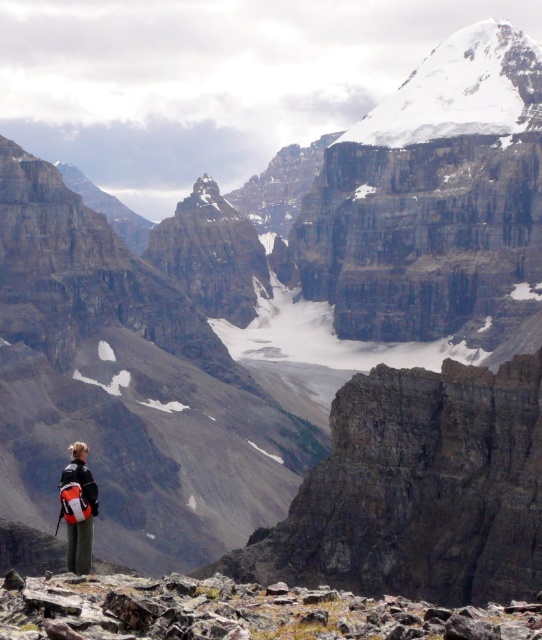
Who is more distant from viewer, (214, 586) or (449, 106)?

Point (449, 106)

Which is more to the right, rusty rock at lower left or white snow-covered peak at upper center?

From the viewer's perspective, white snow-covered peak at upper center appears more on the right side.

The height and width of the screenshot is (640, 542). Describe the element at coordinates (236, 611) in the screenshot. I see `rusty rock at lower left` at that location.

The width and height of the screenshot is (542, 640). Identify the location of rusty rock at lower left. (236, 611).

Which is behind, point (427, 627) or point (62, 509)?

The point (62, 509) is more distant.

Does rusty rock at lower left have a lesser height compared to matte black backpack at lower left?

Incorrect, rusty rock at lower left's height does not fall short of matte black backpack at lower left's.

Does point (246, 588) come closer to viewer compared to point (93, 508)?

Yes, point (246, 588) is in front of point (93, 508).

The height and width of the screenshot is (640, 542). I want to click on rusty rock at lower left, so (236, 611).

Describe the element at coordinates (461, 90) in the screenshot. Image resolution: width=542 pixels, height=640 pixels. I see `white snow-covered peak at upper center` at that location.

Is white snow-covered peak at upper center wider than matte black backpack at lower left?

Yes, white snow-covered peak at upper center is wider than matte black backpack at lower left.

Identify the location of white snow-covered peak at upper center. Image resolution: width=542 pixels, height=640 pixels. (461, 90).

Locate an element on the screen. Image resolution: width=542 pixels, height=640 pixels. white snow-covered peak at upper center is located at coordinates (461, 90).